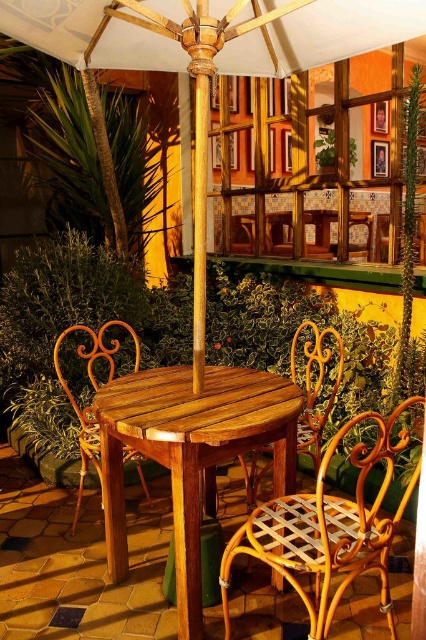
Can you confirm if teak wood table at center is bigger than light brown woven wood chair at lower right?

Incorrect, teak wood table at center is not larger than light brown woven wood chair at lower right.

Is teak wood table at center smaller than light brown woven wood chair at lower right?

Yes.

Is point (123, 541) farther from camera compared to point (342, 429)?

Yes, point (123, 541) is farther from viewer.

Where is `teak wood table at center`? The height and width of the screenshot is (640, 426). teak wood table at center is located at coordinates (189, 452).

Is teak wood table at center below wooden wicker chair at left?

Correct, teak wood table at center is located below wooden wicker chair at left.

Which of these two, teak wood table at center or wooden wicker chair at left, stands taller?

A: Standing taller between the two is wooden wicker chair at left.

Is point (224, 388) closer to camera compared to point (112, 346)?

Yes.

Locate an element on the screen. teak wood table at center is located at coordinates (189, 452).

Which is behind, point (158, 401) or point (298, 444)?

Positioned behind is point (298, 444).

Between point (115, 525) and point (307, 394), which one is positioned in front?

Point (115, 525) is in front.

What are the coordinates of `teak wood table at center` in the screenshot? It's located at (189, 452).